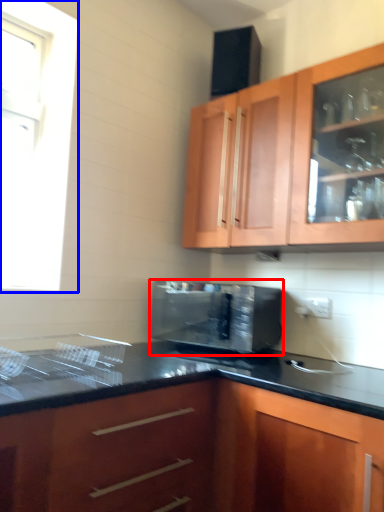
Question: Which object appears farthest to the camera in this image, microwave oven (highlighted by a red box) or window (highlighted by a blue box)?

Choices:
 (A) microwave oven
 (B) window

Answer: (B)